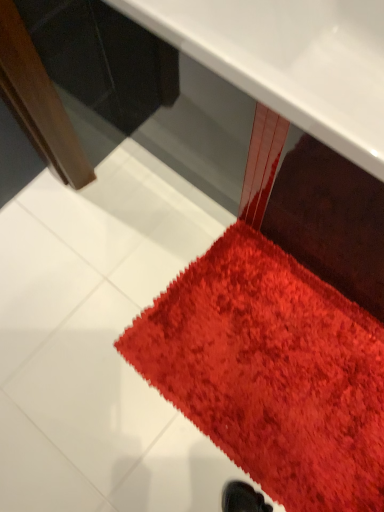
Question: Based on their positions, is glossy plastic table at center located to the left or right of shaggy red carpet at lower right?

Choices:
 (A) left
 (B) right

Answer: (B)

Question: Would you say glossy plastic table at center is inside or outside shaggy red carpet at lower right?

Choices:
 (A) outside
 (B) inside

Answer: (A)

Question: Is point (344, 152) closer or farther from the camera than point (253, 451)?

Choices:
 (A) farther
 (B) closer

Answer: (B)

Question: Do you think shaggy red carpet at lower right is within glossy plastic table at center, or outside of it?

Choices:
 (A) inside
 (B) outside

Answer: (B)

Question: Considering their positions, is shaggy red carpet at lower right located in front of or behind glossy plastic table at center?

Choices:
 (A) behind
 (B) front

Answer: (A)

Question: From the image's perspective, relative to glossy plastic table at center, is shaggy red carpet at lower right above or below?

Choices:
 (A) above
 (B) below

Answer: (B)

Question: From a real-world perspective, is shaggy red carpet at lower right above or below glossy plastic table at center?

Choices:
 (A) above
 (B) below

Answer: (B)